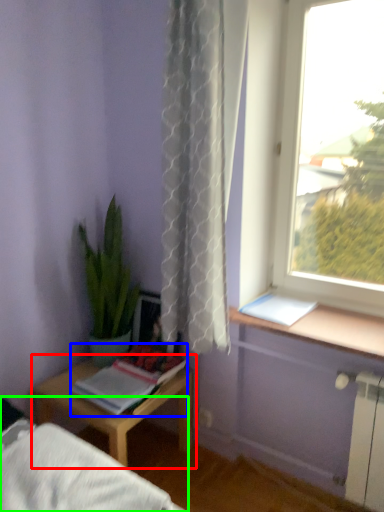
Question: Which object is positioned closest to table (highlighted by a red box)? Select from book (highlighted by a blue box) and bed frame (highlighted by a green box).

Choices:
 (A) book
 (B) bed frame

Answer: (A)